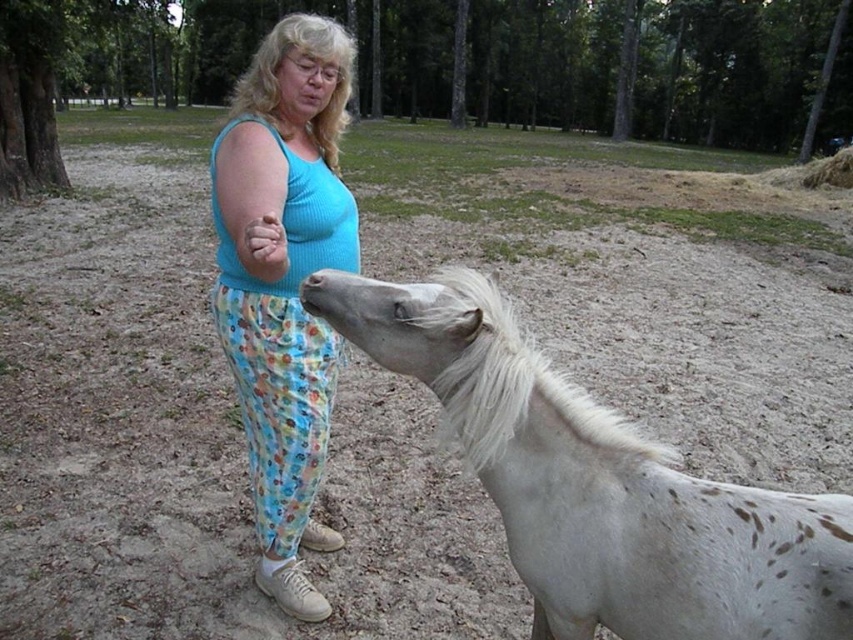
Question: Among these objects, which one is nearest to the camera?

Choices:
 (A) blue cotton tank top at center
 (B) white speckled horse at lower right

Answer: (B)

Question: Is white speckled horse at lower right below blue cotton tank top at center?

Choices:
 (A) yes
 (B) no

Answer: (A)

Question: Does white speckled horse at lower right appear under blue cotton tank top at center?

Choices:
 (A) no
 (B) yes

Answer: (B)

Question: Does white speckled horse at lower right appear on the left side of blue cotton tank top at center?

Choices:
 (A) no
 (B) yes

Answer: (A)